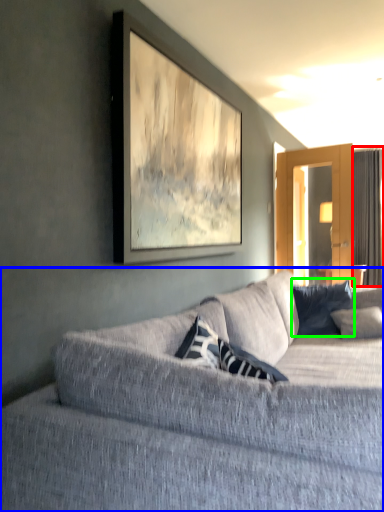
Question: Estimate the real-world distances between objects in this image. Which object is closer to curtain (highlighted by a red box), studio couch (highlighted by a blue box) or pillow (highlighted by a green box)?

Choices:
 (A) studio couch
 (B) pillow

Answer: (B)